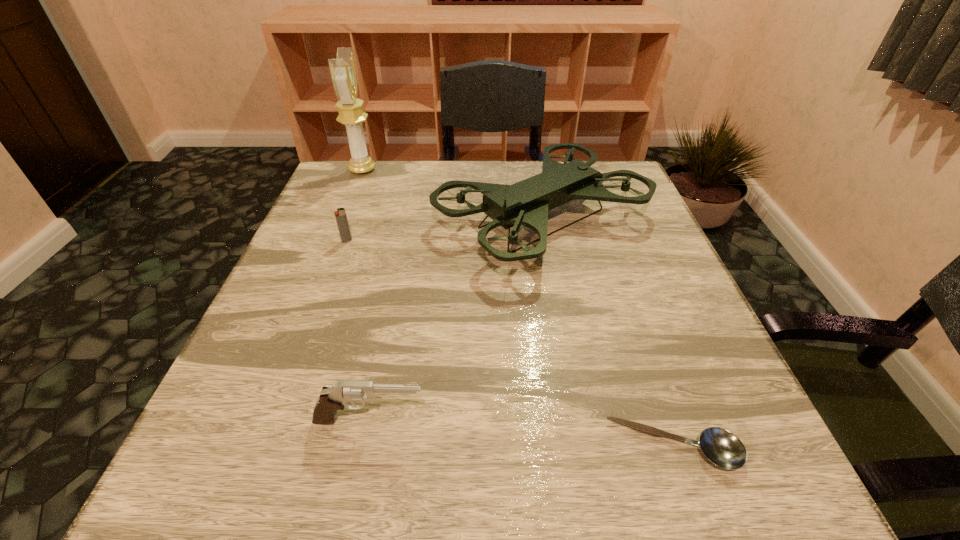
You are a GUI agent. You are given a task and a screenshot of the screen. Output one action in this format:
    pyautogui.click(x=<x>, y=<y>)
    Task: Click on the award
    Image resolution: width=960 pixels, height=540 pixels.
    Given the screenshot: What is the action you would take?
    pyautogui.click(x=342, y=69)

Locate an element on the screen. This screenshot has width=960, height=540. drone is located at coordinates (526, 203).

You are a GUI agent. You are given a task and a screenshot of the screen. Output one action in this format:
    pyautogui.click(x=<x>, y=<y>)
    Task: Click on the gun
    The width and height of the screenshot is (960, 540).
    Given the screenshot: What is the action you would take?
    pyautogui.click(x=332, y=398)

The height and width of the screenshot is (540, 960). What are the coordinates of `the second shortest object` in the screenshot? It's located at (340, 215).

I want to click on the shortest object, so click(x=724, y=449).

This screenshot has width=960, height=540. I want to click on vacant space situated 0.290m on the front-facing side of the award, so click(482, 170).

Identify the location of vacant space located 0.130m on the left of the fourth shortest object. (377, 219).

The width and height of the screenshot is (960, 540). What are the coordinates of `vacant space located 0.400m at the muzzle of the gun` in the screenshot? It's located at (699, 420).

Locate an element on the screen. free region located on the back of the fourth tallest object is located at coordinates (376, 161).

The image size is (960, 540). Find the location of `vacant space positioned on the left of the ladle`. vacant space positioned on the left of the ladle is located at coordinates (361, 447).